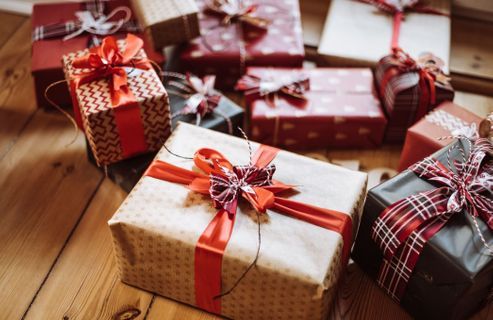
What are the coordinates of `wood planks` in the screenshot? It's located at (x=6, y=27), (x=20, y=56), (x=39, y=183), (x=83, y=254), (x=174, y=309), (x=366, y=307), (x=474, y=68), (x=483, y=105).